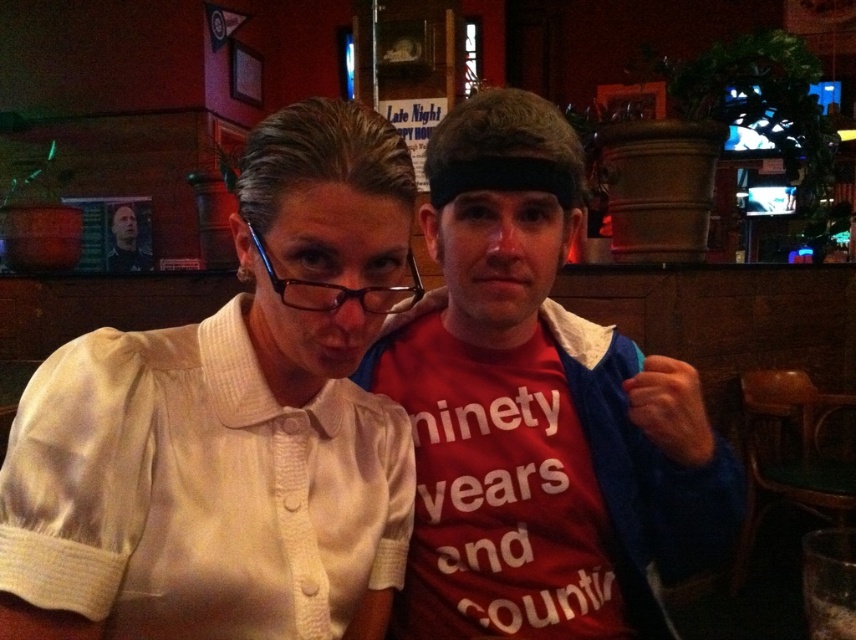
Is white satin blouse at center below red matte t-shirt at center?

Incorrect, white satin blouse at center is not positioned below red matte t-shirt at center.

Which is above, white satin blouse at center or red matte t-shirt at center?

white satin blouse at center

The width and height of the screenshot is (856, 640). In order to click on white satin blouse at center in this screenshot , I will do `click(235, 417)`.

Where is `red matte t-shirt at center`? This screenshot has height=640, width=856. red matte t-shirt at center is located at coordinates [538, 412].

Which of these two, red matte t-shirt at center or matte black hair at upper left, stands taller?

red matte t-shirt at center is taller.

Which is behind, point (660, 413) or point (111, 221)?

Point (111, 221)

What are the coordinates of `red matte t-shirt at center` in the screenshot? It's located at (538, 412).

Can you confirm if white satin blouse at center is positioned to the right of matte black hair at upper left?

Correct, you'll find white satin blouse at center to the right of matte black hair at upper left.

Is point (152, 394) positioned before point (125, 262)?

Yes, point (152, 394) is closer to viewer.

The image size is (856, 640). Find the location of `white satin blouse at center`. white satin blouse at center is located at coordinates (235, 417).